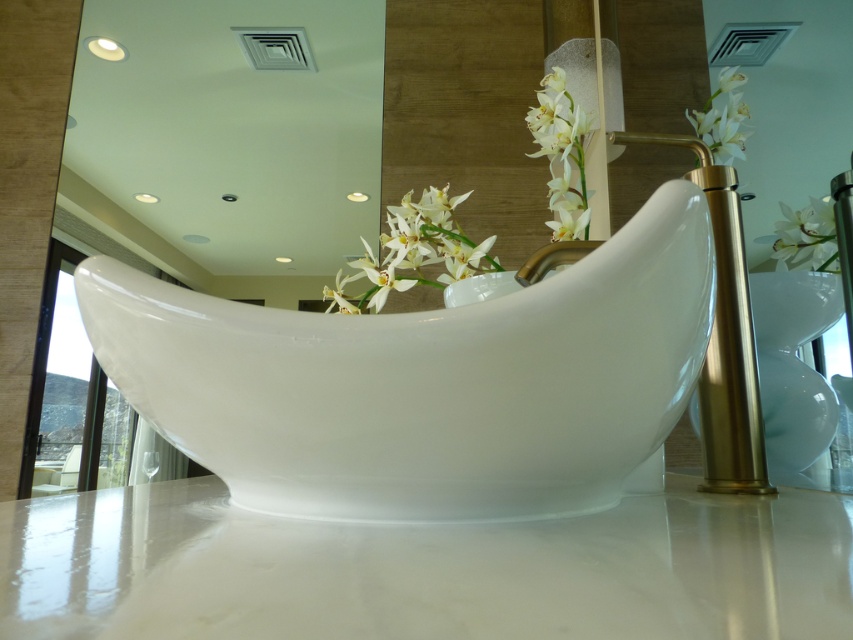
Is white porcelain flowers at upper center taller than white glossy flower at upper right?

Yes.

Can you confirm if white porcelain flowers at upper center is bigger than white glossy flower at upper right?

Correct, white porcelain flowers at upper center is larger in size than white glossy flower at upper right.

Is point (421, 250) farther from viewer compared to point (786, 237)?

No.

Image resolution: width=853 pixels, height=640 pixels. What are the coordinates of `white porcelain flowers at upper center` in the screenshot? It's located at [413, 252].

Is point (424, 248) closer to camera compared to point (740, 106)?

Yes, point (424, 248) is in front of point (740, 106).

Is white porcelain flowers at upper center to the right of white porcelain flower at upper right from the viewer's perspective?

No, white porcelain flowers at upper center is not to the right of white porcelain flower at upper right.

What do you see at coordinates (413, 252) in the screenshot? I see `white porcelain flowers at upper center` at bounding box center [413, 252].

Image resolution: width=853 pixels, height=640 pixels. Identify the location of white porcelain flowers at upper center. (413, 252).

Is white glossy bathtub at center bigger than white glossy flower at upper right?

Indeed, white glossy bathtub at center has a larger size compared to white glossy flower at upper right.

Where is `white glossy bathtub at center`? This screenshot has height=640, width=853. white glossy bathtub at center is located at coordinates (426, 381).